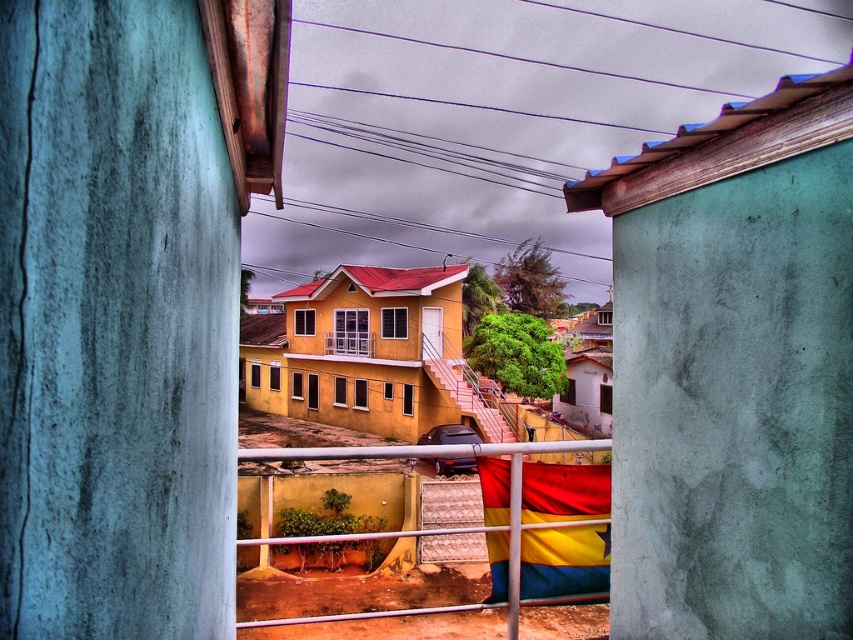
You are standing at the entrance of the teal walls and want to place a small potted plant exactly at the point marked as point (451, 456). What object will the potted plant be placed on?

The point (451, 456) is on metallic silver fence at center, so the potted plant will be placed on the metallic silver fence at center.

You are standing in the doorway looking at the street scene. You see a metallic silver fence at center and a white painted wood balcony at center. Which object is positioned to the right side of the other?

The metallic silver fence at center is to the right of the white painted wood balcony at center.